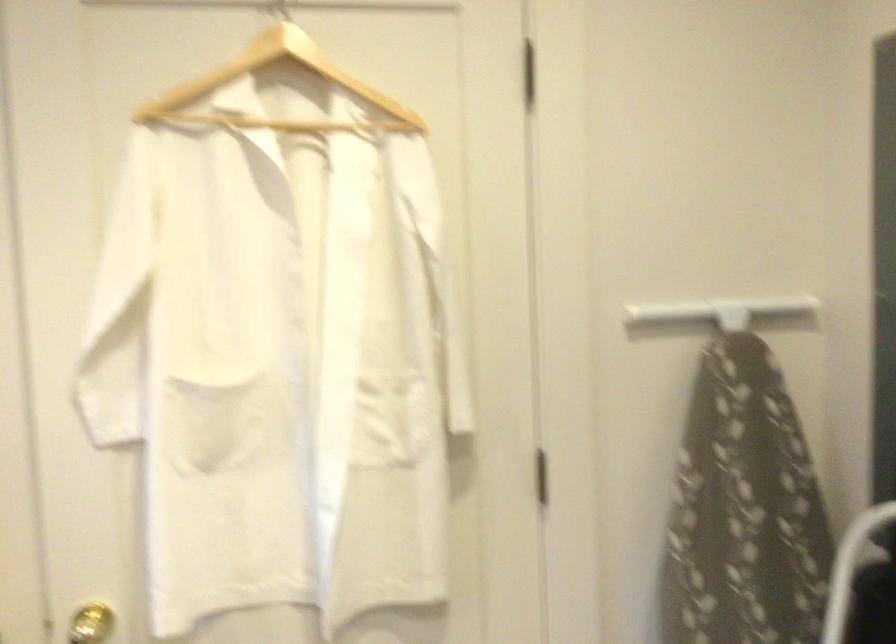
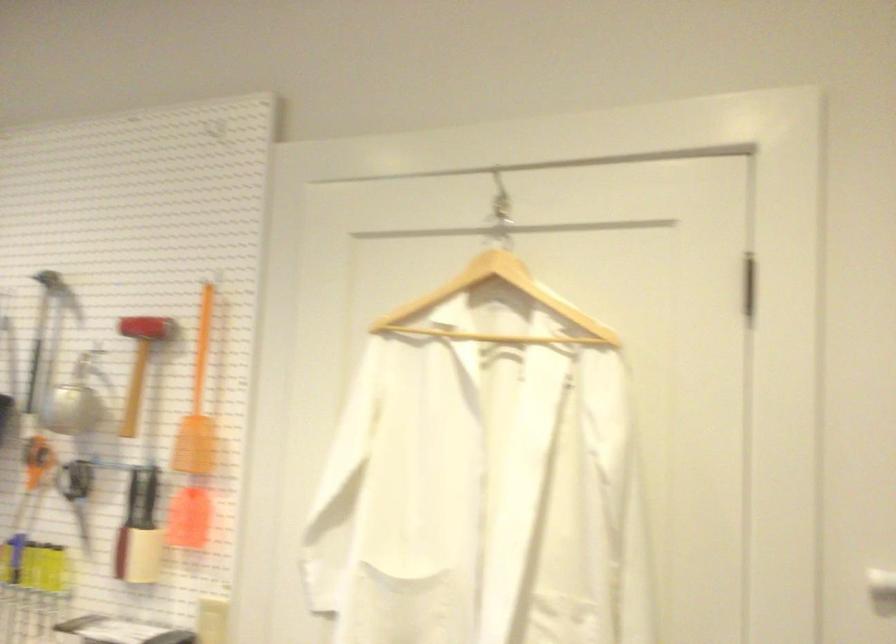
The point at (x=283, y=91) is marked in the first image. Where is the corresponding point in the second image?

(496, 307)